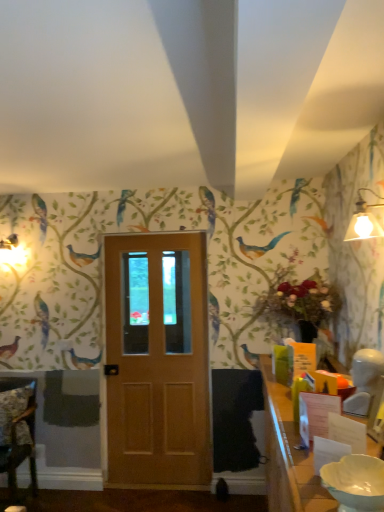
Question: Does white glossy bowl at lower right have a lesser height compared to white glossy table at lower right?

Choices:
 (A) no
 (B) yes

Answer: (B)

Question: From a real-world perspective, does white glossy bowl at lower right sit lower than white glossy table at lower right?

Choices:
 (A) yes
 (B) no

Answer: (B)

Question: Can you confirm if white glossy bowl at lower right is positioned to the left of white glossy table at lower right?

Choices:
 (A) yes
 (B) no

Answer: (A)

Question: Would you say white glossy bowl at lower right is outside white glossy table at lower right?

Choices:
 (A) yes
 (B) no

Answer: (A)

Question: Considering the relative sizes of white glossy bowl at lower right and white glossy table at lower right in the image provided, is white glossy bowl at lower right taller than white glossy table at lower right?

Choices:
 (A) yes
 (B) no

Answer: (B)

Question: Considering the relative sizes of white glossy bowl at lower right and white glossy table at lower right in the image provided, is white glossy bowl at lower right bigger than white glossy table at lower right?

Choices:
 (A) yes
 (B) no

Answer: (B)

Question: Can you confirm if matte wood door at center is positioned to the right of wooden chair at lower left?

Choices:
 (A) yes
 (B) no

Answer: (A)

Question: From a real-world perspective, is matte wood door at center on wooden chair at lower left?

Choices:
 (A) yes
 (B) no

Answer: (A)

Question: Is matte wood door at center thinner than wooden chair at lower left?

Choices:
 (A) yes
 (B) no

Answer: (A)

Question: Is wooden chair at lower left at the back of matte wood door at center?

Choices:
 (A) no
 (B) yes

Answer: (A)

Question: From the image's perspective, is matte wood door at center located beneath wooden chair at lower left?

Choices:
 (A) yes
 (B) no

Answer: (B)

Question: Does matte wood door at center have a lesser height compared to wooden chair at lower left?

Choices:
 (A) no
 (B) yes

Answer: (A)

Question: From a real-world perspective, is wooden chair at lower left on top of matte white lampshade at upper right?

Choices:
 (A) no
 (B) yes

Answer: (A)